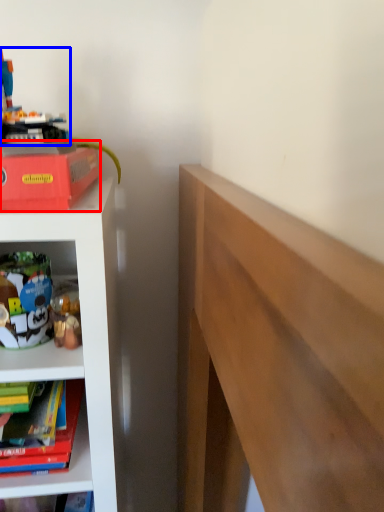
Question: Which of the following is the closest to the observer, paperback book (highlighted by a red box) or toy (highlighted by a blue box)?

Choices:
 (A) paperback book
 (B) toy

Answer: (A)